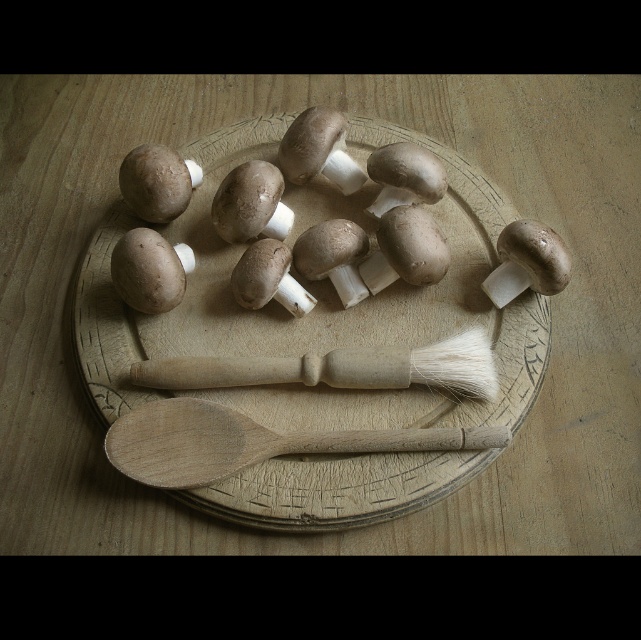
Question: Can you confirm if wooden spoon at lower center is positioned below white bristle brush at center?

Choices:
 (A) no
 (B) yes

Answer: (B)

Question: Does wooden plate at center appear over wooden spoon at lower center?

Choices:
 (A) no
 (B) yes

Answer: (B)

Question: Considering the real-world distances, which object is farthest from the white bristle brush at center?

Choices:
 (A) wooden spoon at lower center
 (B) wooden plate at center

Answer: (B)

Question: Estimate the real-world distances between objects in this image. Which object is closer to the white bristle brush at center?

Choices:
 (A) wooden spoon at lower center
 (B) wooden plate at center

Answer: (A)

Question: Which object is positioned closest to the white bristle brush at center?

Choices:
 (A) wooden plate at center
 (B) wooden spoon at lower center

Answer: (B)

Question: Can you confirm if wooden spoon at lower center is thinner than white bristle brush at center?

Choices:
 (A) yes
 (B) no

Answer: (B)